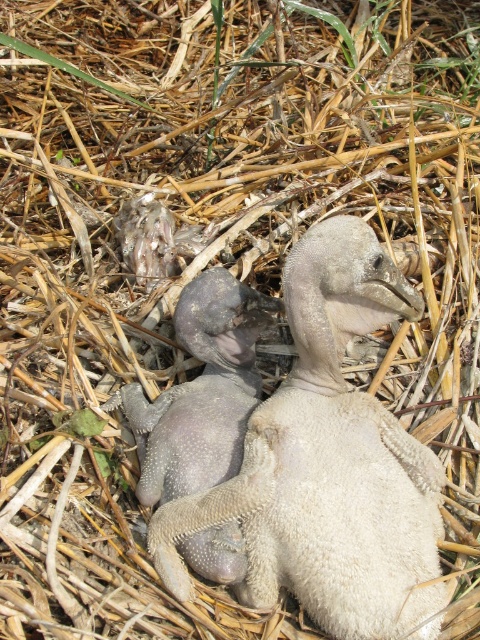
You are a wildlife photographer observing two baby penguins in their nesting ground. You notice a gray downy duckling at center and a purple fuzzy duckling at center. Which one is positioned more to the right side?

The gray downy duckling at center is positioned more to the right side compared to the purple fuzzy duckling at center.

You are a wildlife photographer observing two baby penguins in their nesting ground. You notice a gray downy duckling at center and a purple fuzzy duckling at center. Which one of these two ducklings is larger in size?

The gray downy duckling at center is bigger than the purple fuzzy duckling at center.

You are a photographer trying to capture a closeup of the penguin near point (300, 580). There is another penguin near point (218, 528). Which penguin will be in focus if you focus on the closer one?

The penguin near point (300, 580) will be in focus because it is closer to the camera than the penguin near point (218, 528).